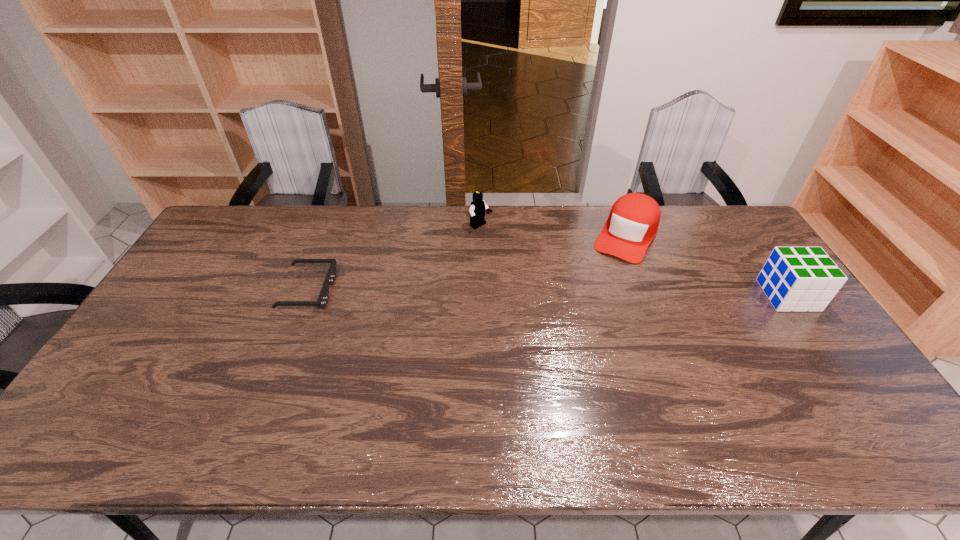
You are a GUI agent. You are given a task and a screenshot of the screen. Output one action in this format:
    pyautogui.click(x=<x>, y=<y>)
    Task: Click on the vacant space located 0.080m on the front-facing side of the third object from right to left
    
    Given the screenshot: What is the action you would take?
    pyautogui.click(x=504, y=242)

Find the location of a particular element. This screenshot has height=540, width=960. free space located 0.210m on the front-facing side of the third object from right to left is located at coordinates (532, 261).

Find the location of `baseball cap that is at the far edge`. baseball cap that is at the far edge is located at coordinates (634, 218).

Where is `Lego that is at the far edge`? This screenshot has width=960, height=540. Lego that is at the far edge is located at coordinates (478, 206).

At what (x,y) coordinates should I click in order to perform the action: click on object at the right edge. Please return your answer as a coordinate pair (x, y). This screenshot has height=540, width=960. Looking at the image, I should click on (799, 279).

At what (x,y) coordinates should I click in order to perform the action: click on vacant region at the far edge. Please return your answer as a coordinate pair (x, y). This screenshot has height=540, width=960. Looking at the image, I should click on (537, 213).

Image resolution: width=960 pixels, height=540 pixels. I want to click on vacant area at the near edge, so click(x=205, y=388).

In the image, there is a desktop. At what (x,y) coordinates should I click in order to perform the action: click on free region at the right edge. Please return your answer as a coordinate pair (x, y). Looking at the image, I should click on coord(810,377).

This screenshot has width=960, height=540. Find the location of `vacant space at the far right corner of the desktop`. vacant space at the far right corner of the desktop is located at coordinates (749, 243).

The image size is (960, 540). In order to click on free region at the near right corner of the desktop in this screenshot , I will do `click(845, 403)`.